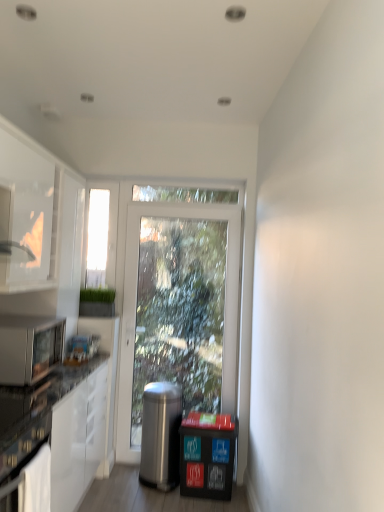
Question: Does white glossy cabinet at left appear on the left side of satin black microwave oven at lower left?

Choices:
 (A) yes
 (B) no

Answer: (A)

Question: Is satin black microwave oven at lower left a part of white glossy cabinet at left?

Choices:
 (A) yes
 (B) no

Answer: (B)

Question: Considering the relative sizes of white glossy cabinet at left and satin black microwave oven at lower left in the image provided, is white glossy cabinet at left taller than satin black microwave oven at lower left?

Choices:
 (A) yes
 (B) no

Answer: (A)

Question: From the image's perspective, is white glossy cabinet at left under satin black microwave oven at lower left?

Choices:
 (A) no
 (B) yes

Answer: (A)

Question: Are white glossy cabinet at left and satin black microwave oven at lower left far apart?

Choices:
 (A) no
 (B) yes

Answer: (A)

Question: Which is correct: white glossy cabinet at left is inside transparent glass window screen at left, or outside of it?

Choices:
 (A) outside
 (B) inside

Answer: (A)

Question: Relative to transparent glass window screen at left, is white glossy cabinet at left in front or behind?

Choices:
 (A) behind
 (B) front

Answer: (B)

Question: From a real-world perspective, is white glossy cabinet at left positioned above or below transparent glass window screen at left?

Choices:
 (A) below
 (B) above

Answer: (A)

Question: In terms of height, does white glossy cabinet at left look taller or shorter compared to transparent glass window screen at left?

Choices:
 (A) short
 (B) tall

Answer: (B)

Question: Is transparent glass window screen at left wider or thinner than polished stainless steel trash can at center?

Choices:
 (A) thin
 (B) wide

Answer: (A)

Question: Considering the positions of point 96,214 and point 177,458, is point 96,214 closer or farther from the camera than point 177,458?

Choices:
 (A) closer
 (B) farther

Answer: (B)

Question: Is transparent glass window screen at left inside the boundaries of polished stainless steel trash can at center, or outside?

Choices:
 (A) outside
 (B) inside

Answer: (A)

Question: From a real-world perspective, is transparent glass window screen at left positioned above or below polished stainless steel trash can at center?

Choices:
 (A) below
 (B) above

Answer: (B)

Question: Considering the positions of point (150, 401) and point (236, 423), is point (150, 401) closer or farther from the camera than point (236, 423)?

Choices:
 (A) closer
 (B) farther

Answer: (B)

Question: Looking at their shapes, would you say polished stainless steel trash can at center is wider or thinner than black plastic recycling bin at lower right?

Choices:
 (A) wide
 (B) thin

Answer: (A)